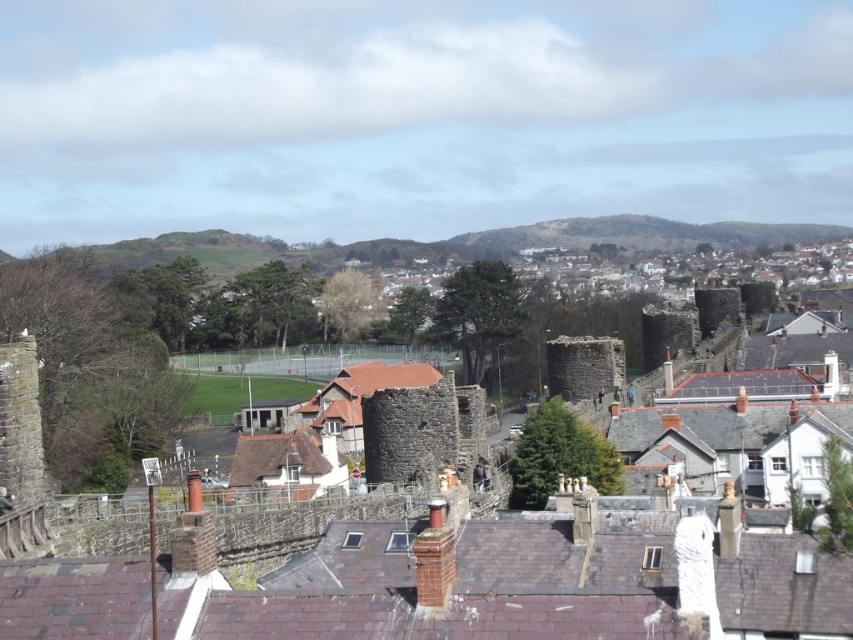
Question: Is stone wall at center closer to the viewer compared to stone tower at center?

Choices:
 (A) no
 (B) yes

Answer: (B)

Question: Which point is closer to the camera?

Choices:
 (A) (305, 465)
 (B) (599, 596)

Answer: (B)

Question: From the image, what is the correct spatial relationship of stone wall at center in relation to stone tower at center?

Choices:
 (A) right
 (B) left

Answer: (A)

Question: Is stone wall at center closer to camera compared to stone tower at center?

Choices:
 (A) no
 (B) yes

Answer: (B)